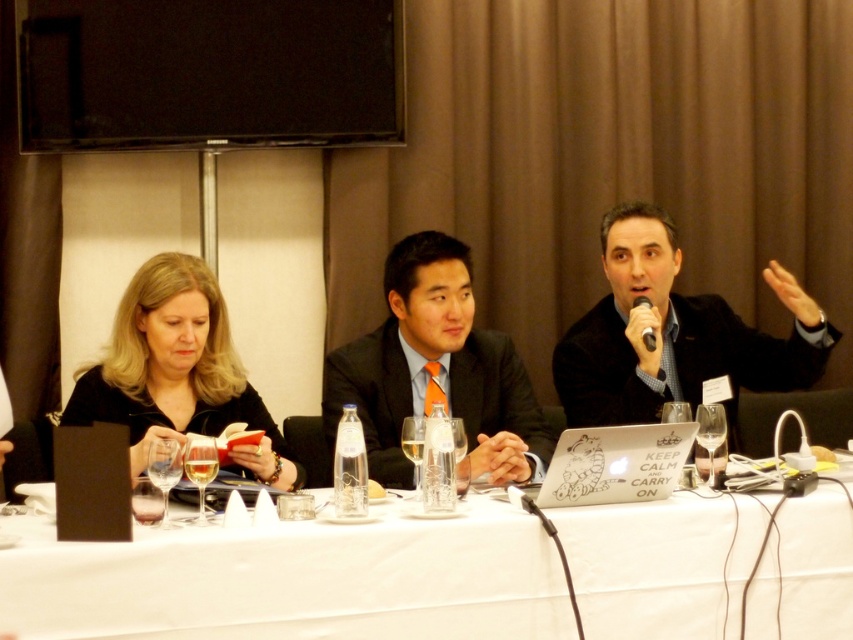
You are attending a conference and need to identify the tallest person based on their suits. Which of the following is taller between the black wool suit at right and the matte black suit at center?

The black wool suit at right is taller than the matte black suit at center.

You are an attendee at the conference and want to approach the table. You see two points marked on the floor near the table. The first point is at coordinates point (798, 624) and the second is at point (257, 406). Which point is closer to the front of the table?

Point (798, 624) is in front of point (257, 406), so the first point is closer to the front of the table.

You are attending a conference and want to hand a document to the person wearing the black matte jacket at left. The microphone is in the way. Can you move the black plastic microphone at upper center to the right to make space?

The black matte jacket at left is to the left of the black plastic microphone at upper center, so moving the microphone to the right would create space between them, allowing you to reach the jacket wearer.